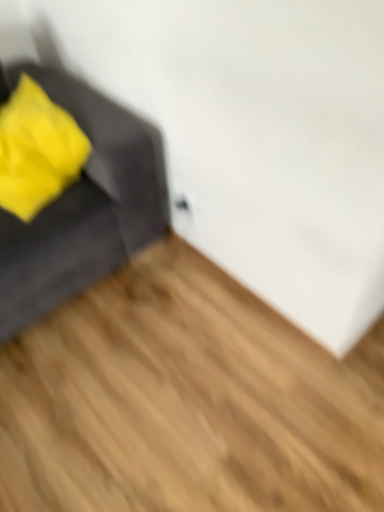
Question: Can you confirm if velvet gray sofa at left is bigger than soft yellow fabric at left?

Choices:
 (A) yes
 (B) no

Answer: (A)

Question: Does velvet gray sofa at left lie in front of soft yellow fabric at left?

Choices:
 (A) no
 (B) yes

Answer: (B)

Question: From a real-world perspective, is velvet gray sofa at left located beneath soft yellow fabric at left?

Choices:
 (A) yes
 (B) no

Answer: (A)

Question: From the image's perspective, is velvet gray sofa at left above soft yellow fabric at left?

Choices:
 (A) yes
 (B) no

Answer: (B)

Question: Is velvet gray sofa at left outside of soft yellow fabric at left?

Choices:
 (A) yes
 (B) no

Answer: (A)

Question: Is velvet gray sofa at left facing away from soft yellow fabric at left?

Choices:
 (A) yes
 (B) no

Answer: (A)

Question: Considering the relative sizes of light brown wood flooring at lower left and velvet gray sofa at left in the image provided, is light brown wood flooring at lower left wider than velvet gray sofa at left?

Choices:
 (A) no
 (B) yes

Answer: (B)

Question: Is the surface of light brown wood flooring at lower left in direct contact with velvet gray sofa at left?

Choices:
 (A) yes
 (B) no

Answer: (B)

Question: Considering the relative positions of light brown wood flooring at lower left and velvet gray sofa at left in the image provided, is light brown wood flooring at lower left in front of velvet gray sofa at left?

Choices:
 (A) no
 (B) yes

Answer: (B)

Question: Would you say light brown wood flooring at lower left is outside velvet gray sofa at left?

Choices:
 (A) no
 (B) yes

Answer: (B)

Question: From the image's perspective, does light brown wood flooring at lower left appear higher than velvet gray sofa at left?

Choices:
 (A) no
 (B) yes

Answer: (A)

Question: Does light brown wood flooring at lower left turn towards velvet gray sofa at left?

Choices:
 (A) yes
 (B) no

Answer: (B)

Question: Is soft yellow fabric at left not within light brown wood flooring at lower left?

Choices:
 (A) no
 (B) yes

Answer: (B)